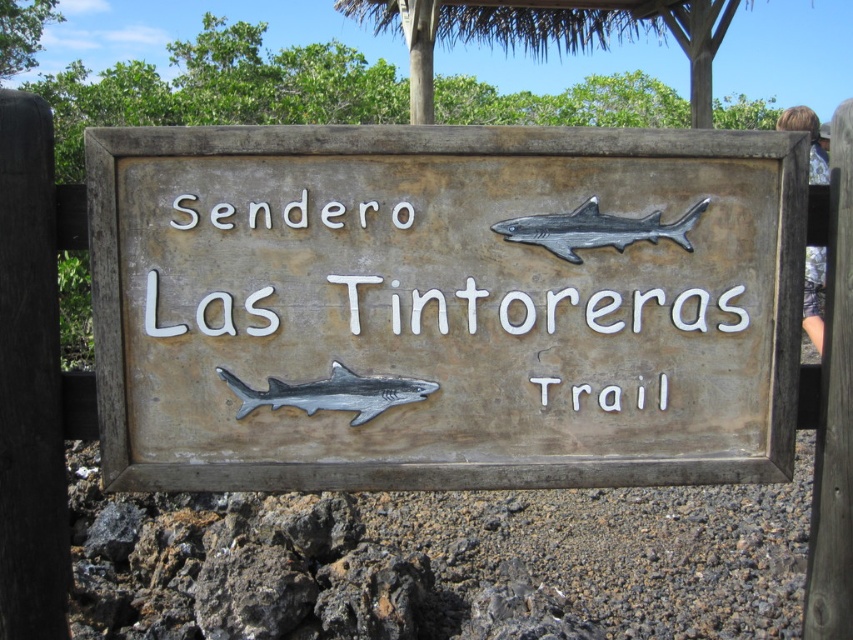
You are standing at the point marked by the coordinates (444, 307). Looking around, you see a weathered wood sign at center. What is directly beneath your feet?

The point at (444, 307) is on the weathered wood sign at center, so the weathered wood sign is directly beneath your feet.

You are an artist who wants to sketch the scene. You need to know the distance between the weathered wood sign at center and the metallic gray shark at upper center. Can you tell me how far apart they are?

The weathered wood sign at center and the metallic gray shark at upper center are 10.00 inches apart from each other.